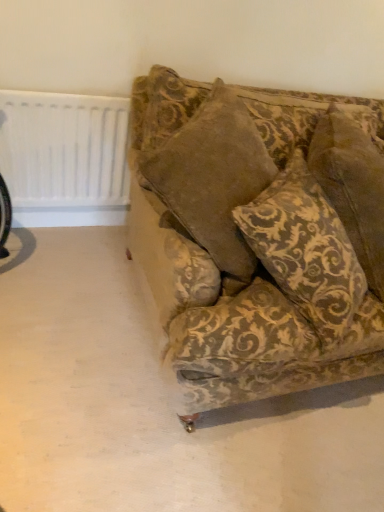
Question: Does white plastic radiator at upper left appear on the left side of velvet gold-patterned pillow at center?

Choices:
 (A) no
 (B) yes

Answer: (B)

Question: Does white plastic radiator at upper left touch velvet gold-patterned pillow at center?

Choices:
 (A) yes
 (B) no

Answer: (B)

Question: From a real-world perspective, is white plastic radiator at upper left on velvet gold-patterned pillow at center?

Choices:
 (A) no
 (B) yes

Answer: (A)

Question: Is velvet gold-patterned pillow at center at the back of white plastic radiator at upper left?

Choices:
 (A) no
 (B) yes

Answer: (A)

Question: Considering the relative sizes of white plastic radiator at upper left and velvet gold-patterned pillow at center in the image provided, is white plastic radiator at upper left wider than velvet gold-patterned pillow at center?

Choices:
 (A) no
 (B) yes

Answer: (A)

Question: Can you confirm if white plastic radiator at upper left is thinner than velvet gold-patterned pillow at center?

Choices:
 (A) no
 (B) yes

Answer: (B)

Question: Is velvet gold-patterned pillow at center shorter than velvet-patterned couch at center?

Choices:
 (A) no
 (B) yes

Answer: (A)

Question: Considering the relative sizes of velvet gold-patterned pillow at center and velvet-patterned couch at center in the image provided, is velvet gold-patterned pillow at center smaller than velvet-patterned couch at center?

Choices:
 (A) yes
 (B) no

Answer: (B)

Question: Is velvet gold-patterned pillow at center positioned before velvet-patterned couch at center?

Choices:
 (A) yes
 (B) no

Answer: (B)

Question: Can we say velvet gold-patterned pillow at center lies outside velvet-patterned couch at center?

Choices:
 (A) no
 (B) yes

Answer: (A)

Question: From the image's perspective, is velvet gold-patterned pillow at center located beneath velvet-patterned couch at center?

Choices:
 (A) no
 (B) yes

Answer: (A)

Question: Is velvet gold-patterned pillow at center facing away from velvet-patterned couch at center?

Choices:
 (A) yes
 (B) no

Answer: (A)

Question: Is velvet-patterned couch at center shorter than white plastic radiator at upper left?

Choices:
 (A) yes
 (B) no

Answer: (B)